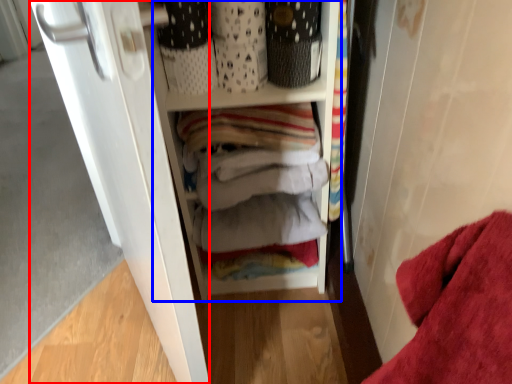
Question: Which object appears closest to the camera in this image, door (highlighted by a red box) or cabinetry (highlighted by a blue box)?

Choices:
 (A) door
 (B) cabinetry

Answer: (A)